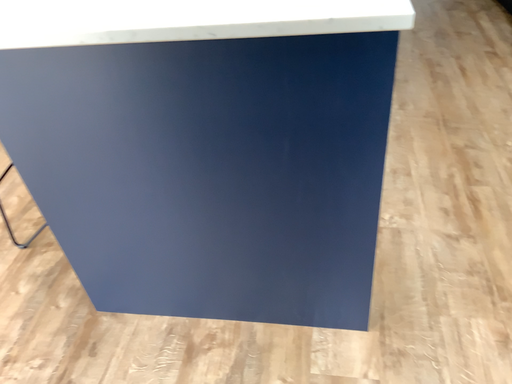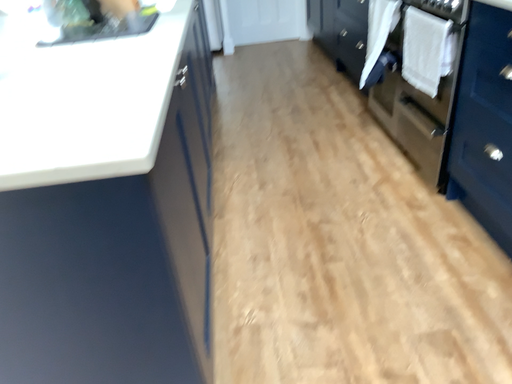
Question: Which way did the camera rotate in the video?

Choices:
 (A) rotated upward
 (B) rotated downward

Answer: (A)